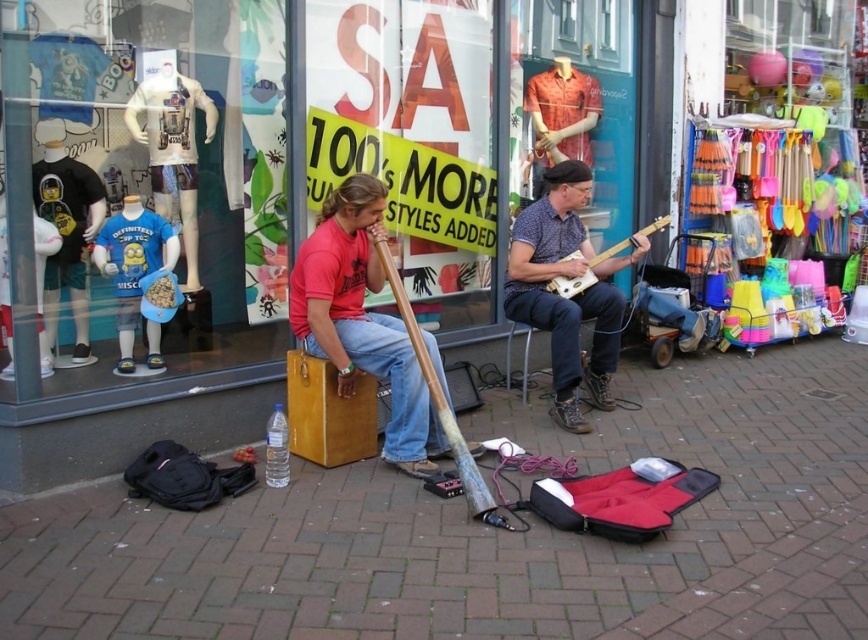
Question: Can you confirm if blue denim jeans at center is positioned to the left of light brown wood electric guitar at center?

Choices:
 (A) no
 (B) yes

Answer: (B)

Question: Among these points, which one is farthest from the camera?

Choices:
 (A) (569, 253)
 (B) (454, 428)

Answer: (A)

Question: Which point is closer to the camera?

Choices:
 (A) wooden stick at center
 (B) light brown wood electric guitar at center
 (C) blue denim jeans at center

Answer: (A)

Question: Can you confirm if wooden stick at center is positioned to the left of light brown wood electric guitar at center?

Choices:
 (A) no
 (B) yes

Answer: (B)

Question: Which point appears farthest from the camera in this image?

Choices:
 (A) (548, 282)
 (B) (439, 515)
 (C) (16, 70)
 (D) (409, 314)

Answer: (A)

Question: Does brick pavement at center have a greater width compared to light brown wood electric guitar at center?

Choices:
 (A) yes
 (B) no

Answer: (A)